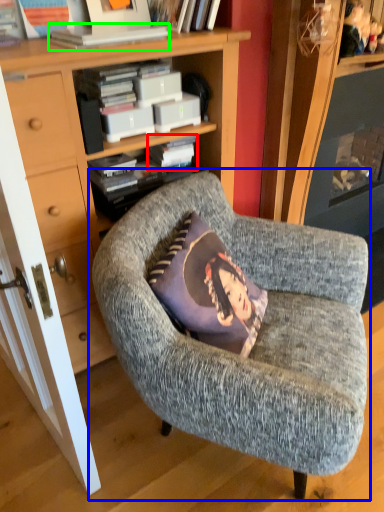
Question: Which is farther away from paperback book (highlighted by a red box)? chair (highlighted by a blue box) or book (highlighted by a green box)?

Choices:
 (A) chair
 (B) book

Answer: (A)